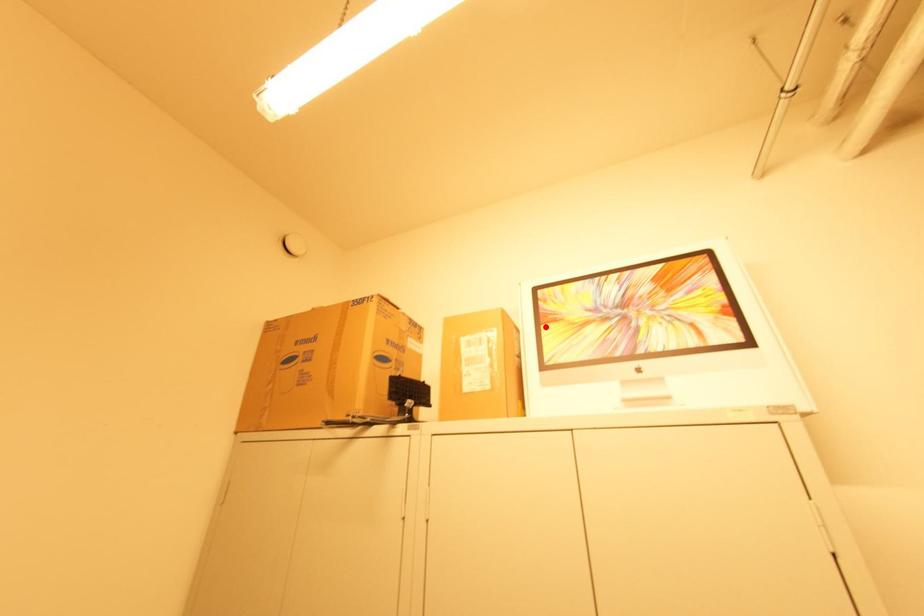
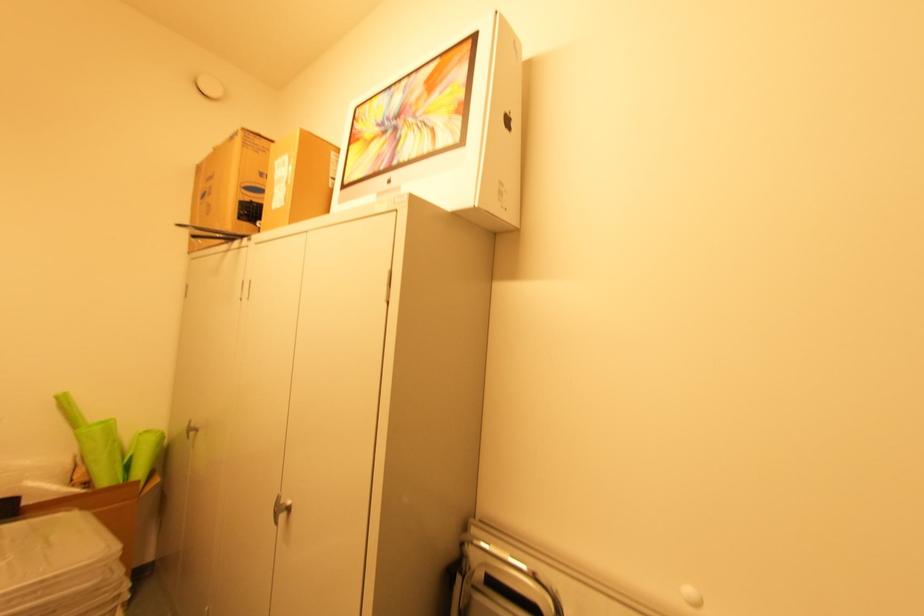
Where in the second image is the point corresponding to the highlighted location from the first image?

(353, 148)